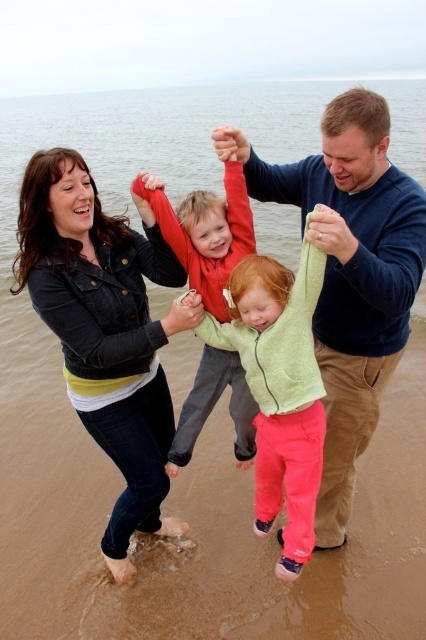
Question: Does blue sweater at upper center appear under light green fleece jacket at center?

Choices:
 (A) yes
 (B) no

Answer: (B)

Question: Is denim jacket at left below light green fleece jacket at center?

Choices:
 (A) yes
 (B) no

Answer: (B)

Question: Estimate the real-world distances between objects in this image. Which object is closer to the light green fleece jacket at center?

Choices:
 (A) red fleece sweater at center
 (B) brown sandy beach at lower center
 (C) blue sweater at upper center

Answer: (C)

Question: Which point is closer to the camera?

Choices:
 (A) (164, 448)
 (B) (271, 416)

Answer: (B)

Question: Can you confirm if denim jacket at left is positioned below red fleece sweater at center?

Choices:
 (A) yes
 (B) no

Answer: (A)

Question: Based on their relative distances, which object is nearer to the blue sweater at upper center?

Choices:
 (A) light green fleece jacket at center
 (B) red fleece sweater at center

Answer: (A)